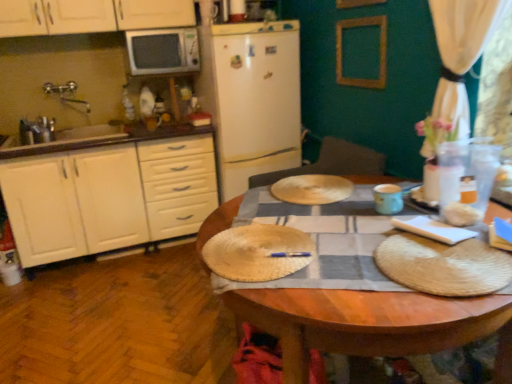
Question: Does white fabric curtain at upper right have a larger size compared to bamboo placemat at center?

Choices:
 (A) yes
 (B) no

Answer: (A)

Question: Does white fabric curtain at upper right appear on the left side of bamboo placemat at center?

Choices:
 (A) no
 (B) yes

Answer: (A)

Question: Can you confirm if white fabric curtain at upper right is positioned to the right of bamboo placemat at center?

Choices:
 (A) no
 (B) yes

Answer: (B)

Question: Is white fabric curtain at upper right outside of bamboo placemat at center?

Choices:
 (A) no
 (B) yes

Answer: (B)

Question: From the image's perspective, is white fabric curtain at upper right located above bamboo placemat at center?

Choices:
 (A) yes
 (B) no

Answer: (A)

Question: In terms of size, does wooden frame at upper center appear bigger or smaller than bamboo placemat at center?

Choices:
 (A) big
 (B) small

Answer: (A)

Question: Is point (362, 23) closer or farther from the camera than point (231, 279)?

Choices:
 (A) closer
 (B) farther

Answer: (B)

Question: Is wooden frame at upper center wider or thinner than bamboo placemat at center?

Choices:
 (A) thin
 (B) wide

Answer: (A)

Question: From their relative heights in the image, would you say wooden frame at upper center is taller or shorter than bamboo placemat at center?

Choices:
 (A) short
 (B) tall

Answer: (B)

Question: From the image's perspective, is white matte cabinet at left above or below white fabric curtain at upper right?

Choices:
 (A) above
 (B) below

Answer: (B)

Question: Considering the positions of white matte cabinet at left and white fabric curtain at upper right in the image, is white matte cabinet at left wider or thinner than white fabric curtain at upper right?

Choices:
 (A) wide
 (B) thin

Answer: (A)

Question: Based on their sizes in the image, would you say white matte cabinet at left is bigger or smaller than white fabric curtain at upper right?

Choices:
 (A) big
 (B) small

Answer: (A)

Question: Would you say white matte cabinet at left is to the left or to the right of white fabric curtain at upper right in the picture?

Choices:
 (A) right
 (B) left

Answer: (B)

Question: From a real-world perspective, is matte blue cup at center right positioned above or below white matte microwave at upper left?

Choices:
 (A) below
 (B) above

Answer: (A)

Question: Looking at the image, does matte blue cup at center right seem bigger or smaller compared to white matte microwave at upper left?

Choices:
 (A) big
 (B) small

Answer: (B)